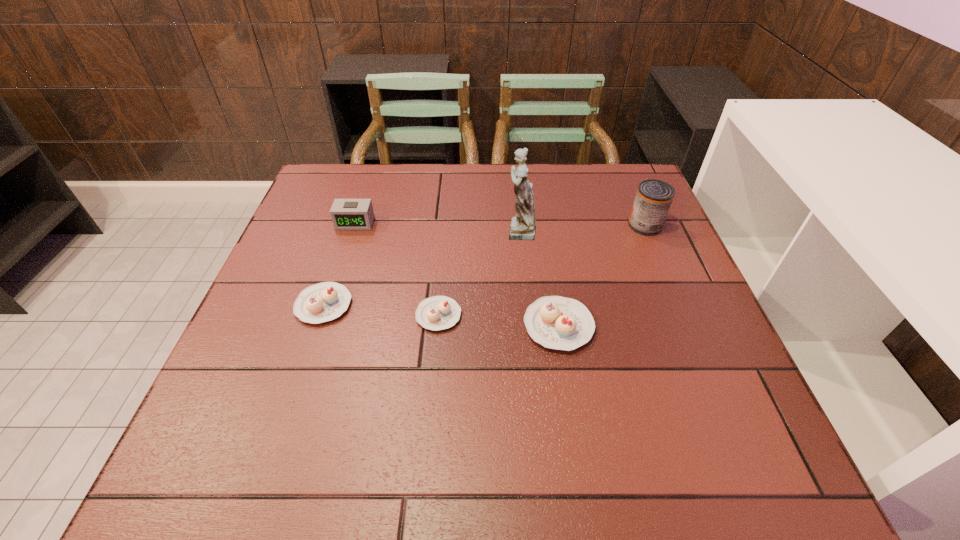
In order to click on free space at the far edge in this screenshot , I will do `click(418, 179)`.

You are a GUI agent. You are given a task and a screenshot of the screen. Output one action in this format:
    pyautogui.click(x=<x>, y=<y>)
    Task: Click on the vacant space at the near edge
    This screenshot has width=960, height=540.
    Given the screenshot: What is the action you would take?
    pyautogui.click(x=388, y=400)

Find the location of a particular element. vacant point at the left edge is located at coordinates (273, 360).

You are a GUI agent. You are given a task and a screenshot of the screen. Output one action in this format:
    pyautogui.click(x=<x>, y=<y>)
    Task: Click on the vacant space at the right edge of the desktop
    This screenshot has height=540, width=960.
    Given the screenshot: What is the action you would take?
    pyautogui.click(x=632, y=258)

The height and width of the screenshot is (540, 960). I want to click on vacant space at the far left corner of the desktop, so click(315, 192).

In the image, there is a desktop. Find the location of `vacant space at the near left corner`. vacant space at the near left corner is located at coordinates (272, 396).

Identify the location of free space at the far right corner of the desktop. The image size is (960, 540). (624, 186).

Locate an element on the screen. This screenshot has width=960, height=540. vacant point located between the shortest cupcake and the rightmost cupcake is located at coordinates (498, 320).

Where is `free point between the alarm clock and the rightmost object`? The width and height of the screenshot is (960, 540). free point between the alarm clock and the rightmost object is located at coordinates (500, 224).

This screenshot has height=540, width=960. I want to click on empty location between the tallest object and the rightmost cupcake, so click(x=539, y=278).